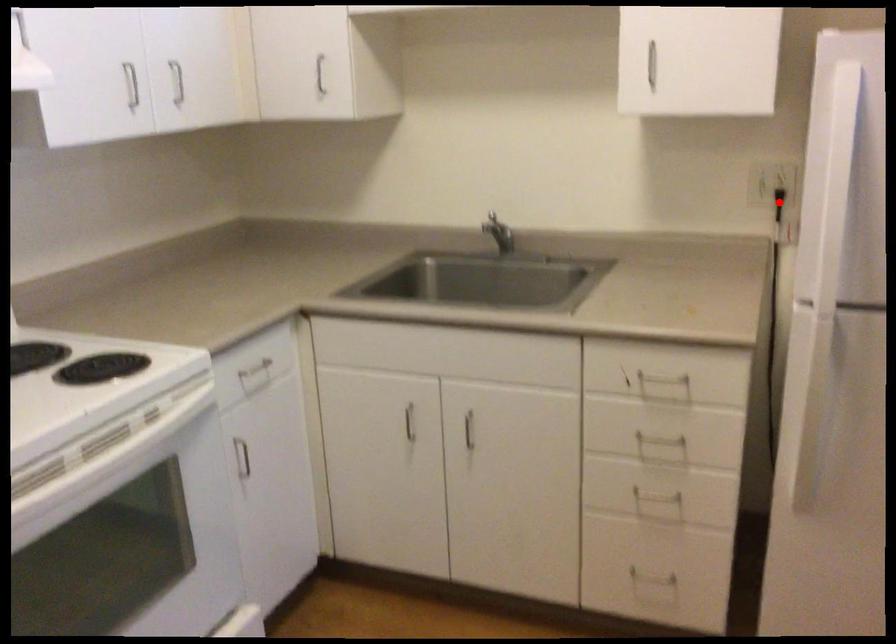
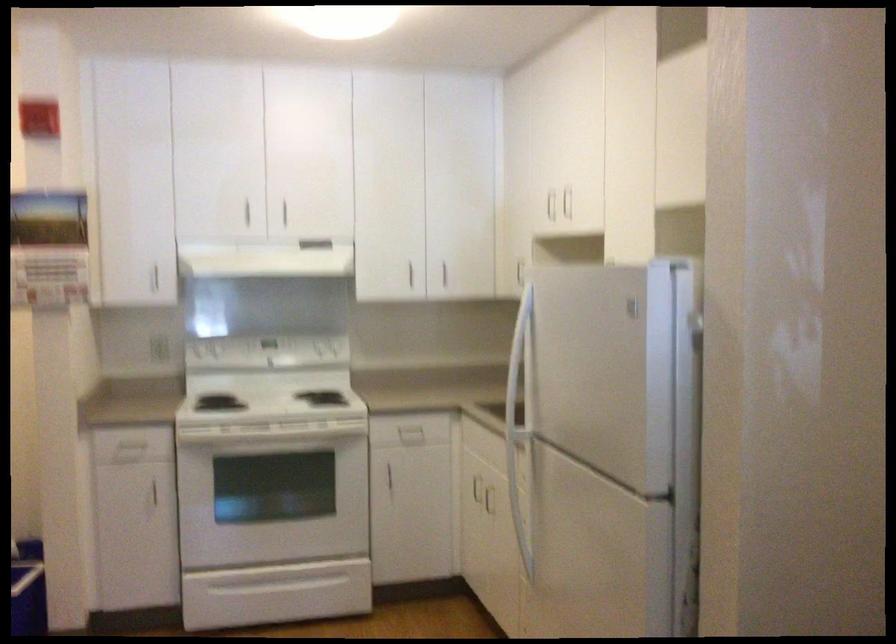
Question: I am providing you with two images of the same scene from different viewpoints. A red point is marked on the first image. Can you still see the location of the red point in image 2?

Choices:
 (A) Yes
 (B) No

Answer: (B)